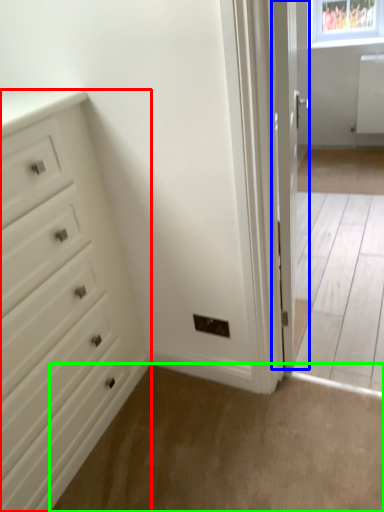
Question: Considering the real-world distances, which object is closest to chest of drawers (highlighted by a red box)? door (highlighted by a blue box) or plain (highlighted by a green box).

Choices:
 (A) door
 (B) plain

Answer: (B)